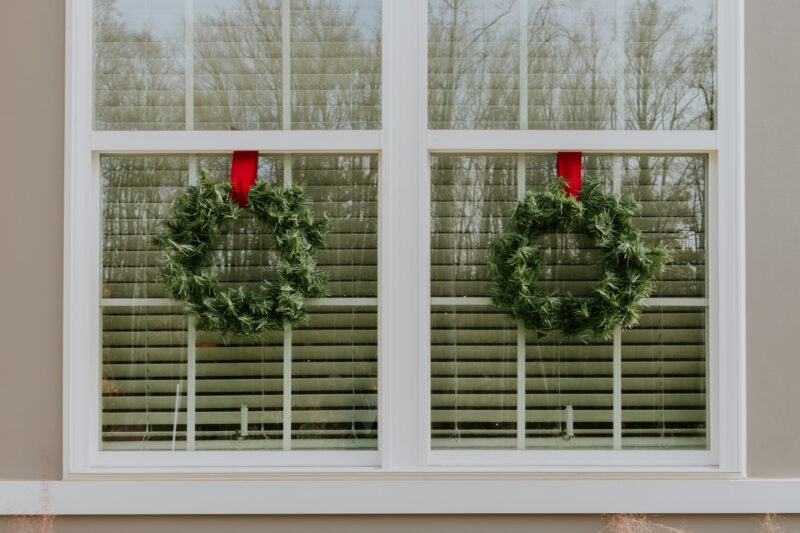
Find the location of a particular element. lower right window pane is located at coordinates (662, 405).